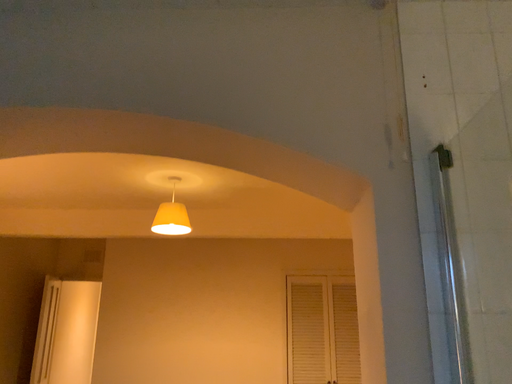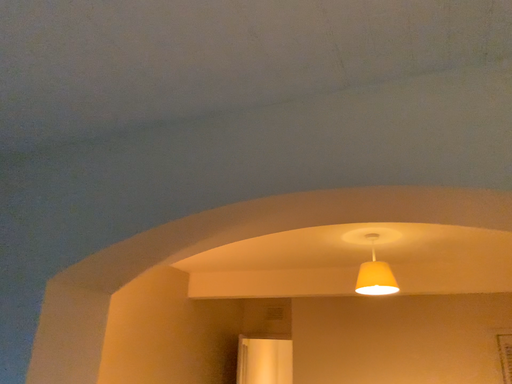
Question: Which way did the camera rotate in the video?

Choices:
 (A) rotated left
 (B) rotated right

Answer: (A)